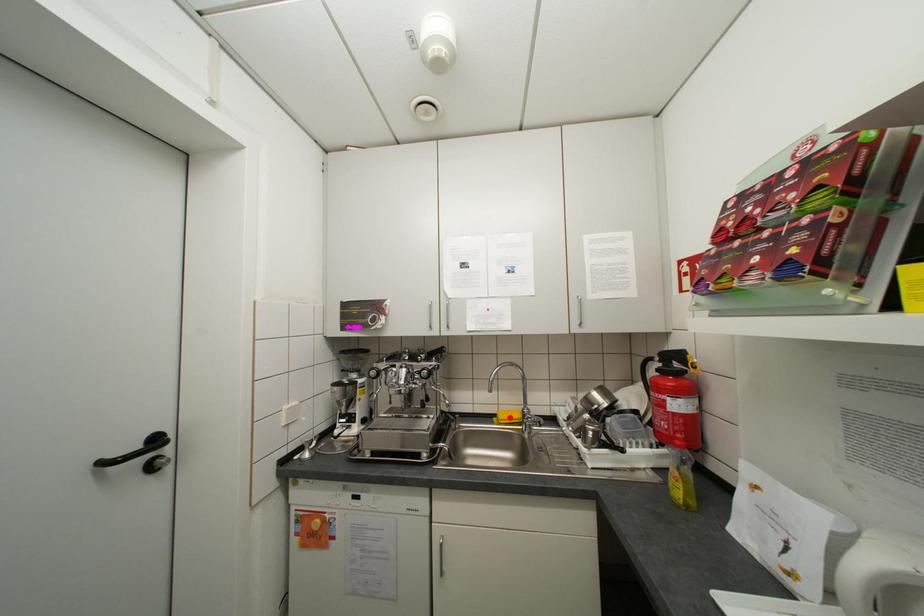
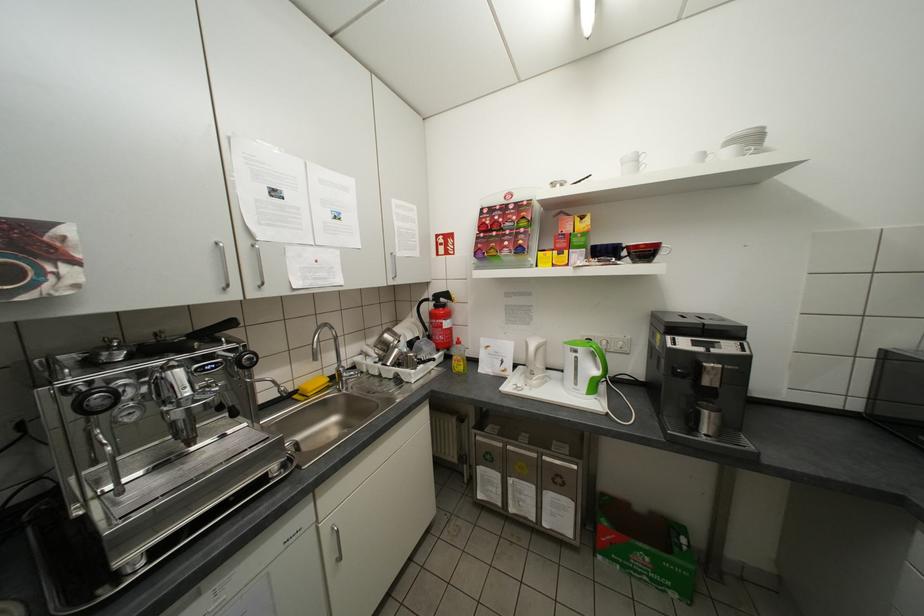
The point at the highlighted location is marked in the first image. Where is the corresponding point in the second image?

(319, 389)